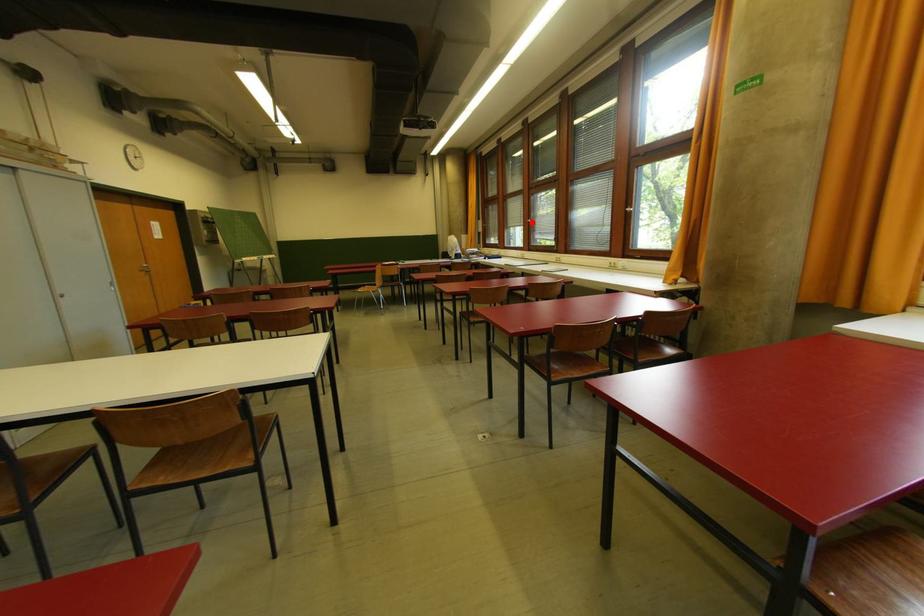
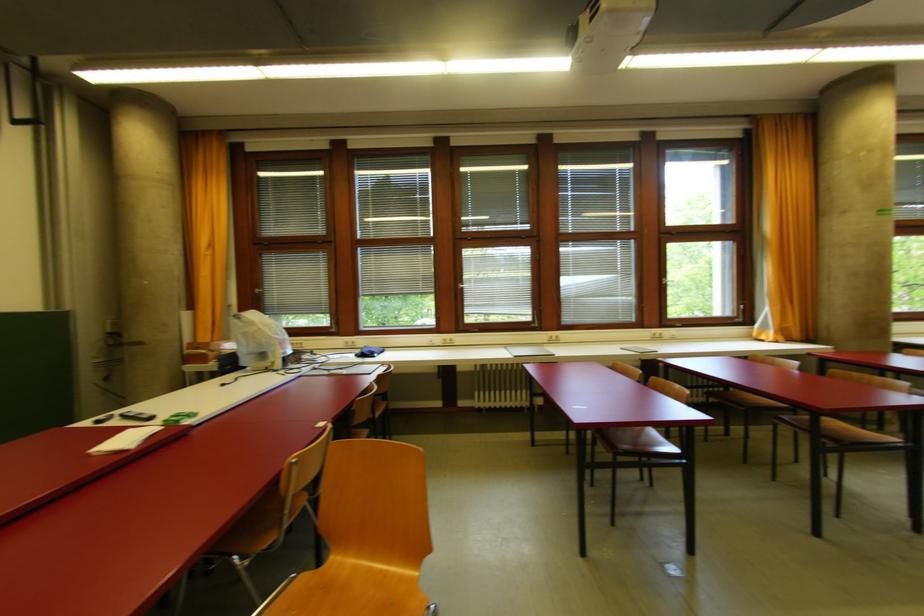
In the second image, find the point that corresponds to the highlighted location in the first image.

(465, 288)